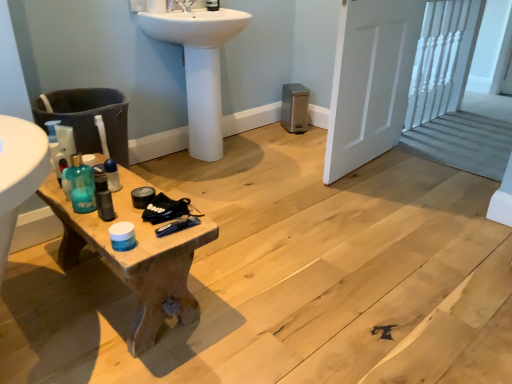
You are a GUI agent. You are given a task and a screenshot of the screen. Output one action in this format:
    pyautogui.click(x=<x>, y=<y>)
    Task: Click on the vacant space in front of matte black soap dispenser at upper center, the 2th toiletry from the left
    This screenshot has height=384, width=512.
    Given the screenshot: What is the action you would take?
    pyautogui.click(x=207, y=7)